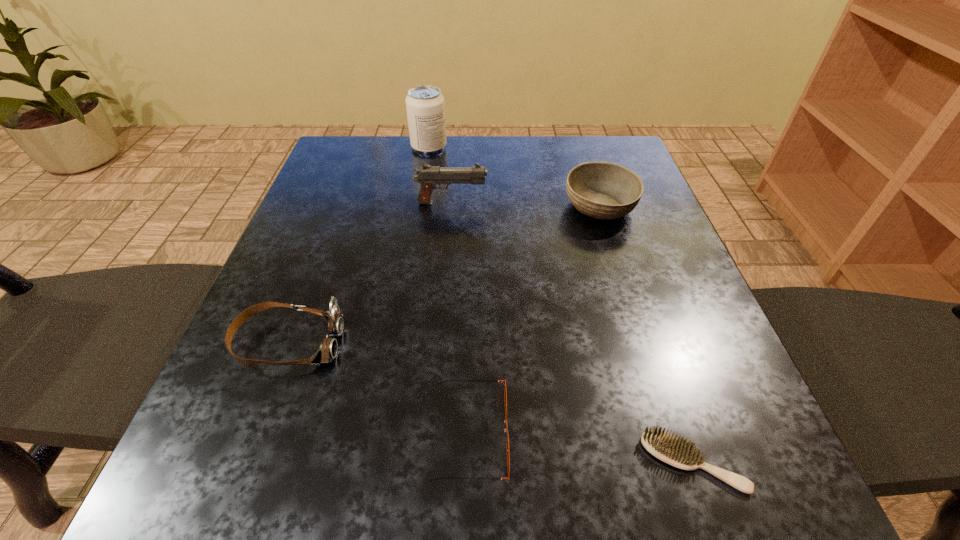
This screenshot has height=540, width=960. What are the coordinates of `blank space that satisfies the following two spatial constraints: 1. in the direction the fifth shortest object is aimed; 2. on the left side of the fourth shortest object` in the screenshot? It's located at (451, 207).

Find the location of a particular element. This screenshot has width=960, height=540. free region that satisfies the following two spatial constraints: 1. in the direction the fifth shortest object is aimed; 2. on the back side of the shortest object is located at coordinates (431, 462).

Locate an element on the screen. vacant space that satisfies the following two spatial constraints: 1. on the front side of the third tallest object; 2. on the face of the fifth tallest object is located at coordinates (673, 433).

Where is `vacant position in the image that satisfies the following two spatial constraints: 1. on the front-facing side of the fourth tallest object; 2. on the back side of the shortest object`? This screenshot has height=540, width=960. vacant position in the image that satisfies the following two spatial constraints: 1. on the front-facing side of the fourth tallest object; 2. on the back side of the shortest object is located at coordinates (244, 462).